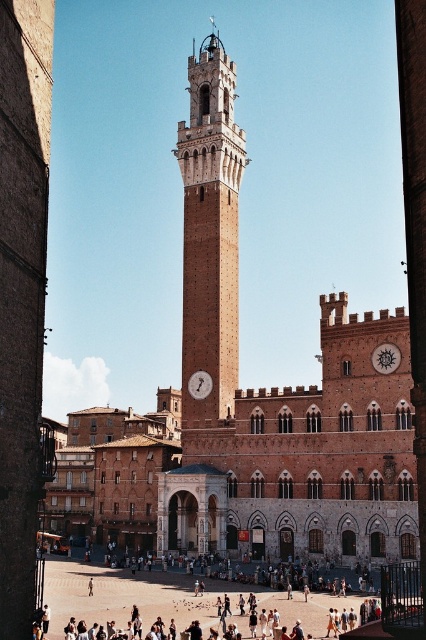
Can you confirm if sandy brown brick clock tower at center is positioned to the right of metallic circular clock at center-right?

In fact, sandy brown brick clock tower at center is to the left of metallic circular clock at center-right.

Who is positioned more to the right, sandy brown brick clock tower at center or metallic circular clock at center-right?

Positioned to the right is metallic circular clock at center-right.

At what (x,y) coordinates should I click in order to perform the action: click on sandy brown brick clock tower at center. Please return your answer as a coordinate pair (x, y). The width and height of the screenshot is (426, 640). Looking at the image, I should click on (210, 232).

Can you confirm if sandy brown brick clock tower at center is taller than matte brown clock at center?

Indeed, sandy brown brick clock tower at center has a greater height compared to matte brown clock at center.

Does sandy brown brick clock tower at center appear under matte brown clock at center?

No, sandy brown brick clock tower at center is not below matte brown clock at center.

Between point (190, 364) and point (192, 376), which one is positioned in front?

Point (192, 376)

At what (x,y) coordinates should I click in order to perform the action: click on sandy brown brick clock tower at center. Please return your answer as a coordinate pair (x, y). The height and width of the screenshot is (640, 426). Looking at the image, I should click on (210, 232).

Is the position of metallic circular clock at center-right more distant than that of matte brown clock at center?

No, it is not.

Looking at this image, does metallic circular clock at center-right have a larger size compared to matte brown clock at center?

Incorrect, metallic circular clock at center-right is not larger than matte brown clock at center.

Does point (389, 355) come closer to viewer compared to point (190, 388)?

Yes, point (389, 355) is closer to viewer.

The width and height of the screenshot is (426, 640). I want to click on metallic circular clock at center-right, so click(385, 356).